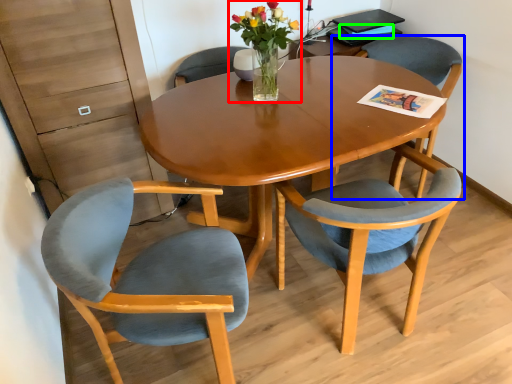
Question: Estimate the real-world distances between objects in this image. Which object is closer to floral arrangement (highlighted by a red box), chair (highlighted by a blue box) or magazine (highlighted by a green box)?

Choices:
 (A) chair
 (B) magazine

Answer: (A)